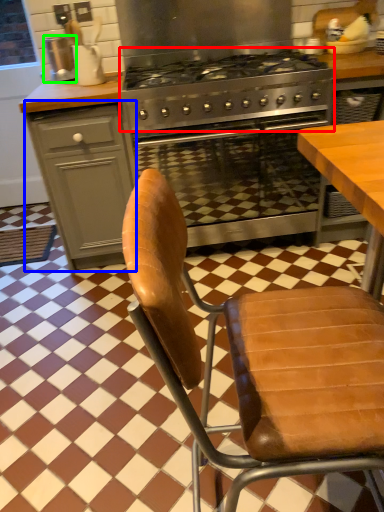
Question: Based on their relative distances, which object is farther from gas stove (highlighted by a red box)? Choose from cabinetry (highlighted by a blue box) and appliance (highlighted by a green box).

Choices:
 (A) cabinetry
 (B) appliance

Answer: (B)